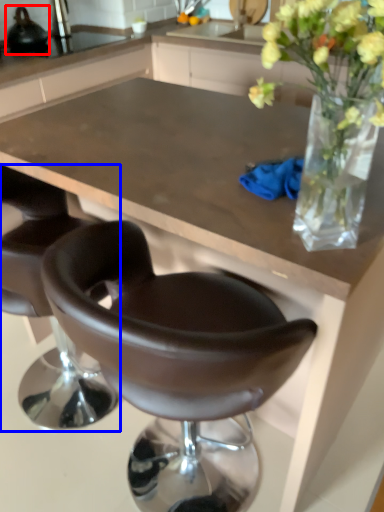
Question: Among these objects, which one is farthest to the camera, appliance (highlighted by a red box) or chair (highlighted by a blue box)?

Choices:
 (A) appliance
 (B) chair

Answer: (A)